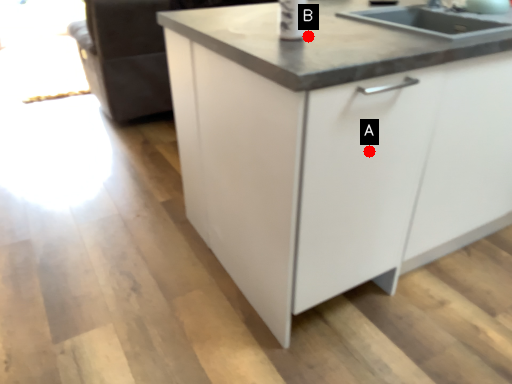
Question: Two points are circled on the image, labeled by A and B beside each circle. Which point is farther from the camera taking this photo?

Choices:
 (A) A is further
 (B) B is further

Answer: (B)